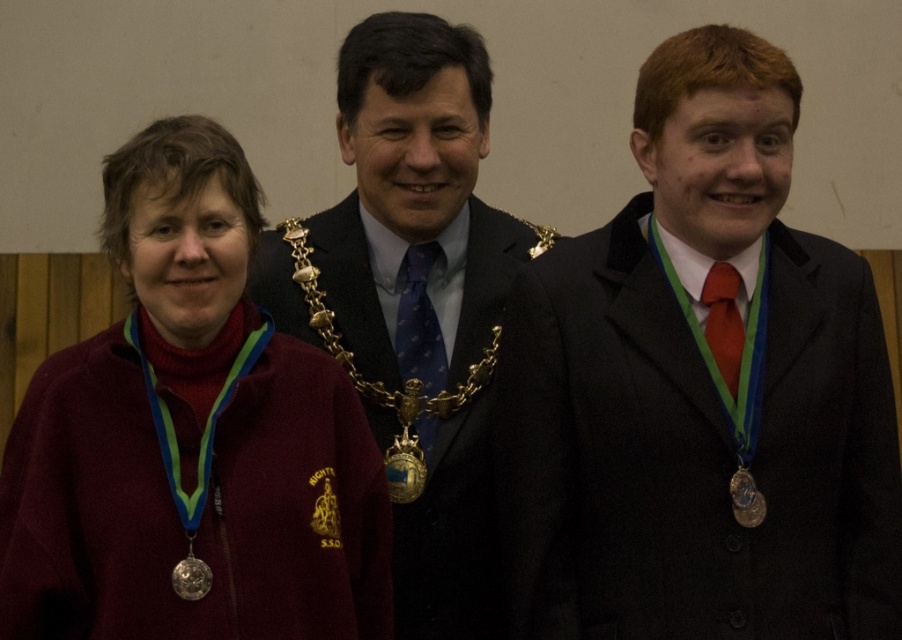
Is blue satin tie at center wider than matte red tie at right?

Yes.

How much distance is there between blue satin tie at center and matte red tie at right?

A distance of 36.59 inches exists between blue satin tie at center and matte red tie at right.

The width and height of the screenshot is (902, 640). In order to click on blue satin tie at center in this screenshot , I will do `click(413, 204)`.

Who is lower down, metallic gold chain at center or silver metallic medal at lower left?

silver metallic medal at lower left

Does metallic gold chain at center appear on the left side of silver metallic medal at lower left?

Incorrect, metallic gold chain at center is not on the left side of silver metallic medal at lower left.

Between point (426, 44) and point (201, 582), which one is positioned in front?

Point (201, 582)

The height and width of the screenshot is (640, 902). Find the location of `metallic gold chain at center`. metallic gold chain at center is located at coordinates (413, 381).

Can you confirm if maroon fleece at center is positioned to the left of matte red tie at right?

Yes, maroon fleece at center is to the left of matte red tie at right.

Is point (223, 348) positioned before point (729, 346)?

Yes, it is.

Is point (226, 316) closer to viewer compared to point (707, 310)?

Yes, point (226, 316) is closer to viewer.

This screenshot has width=902, height=640. What are the coordinates of `maroon fleece at center` in the screenshot? It's located at (190, 332).